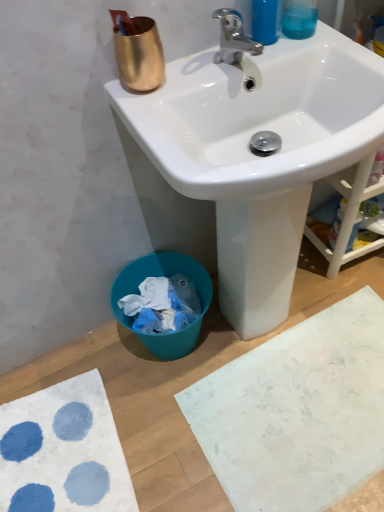
Find the location of `free spot to the left of chrome metallic faucet at upper center`. free spot to the left of chrome metallic faucet at upper center is located at coordinates (183, 79).